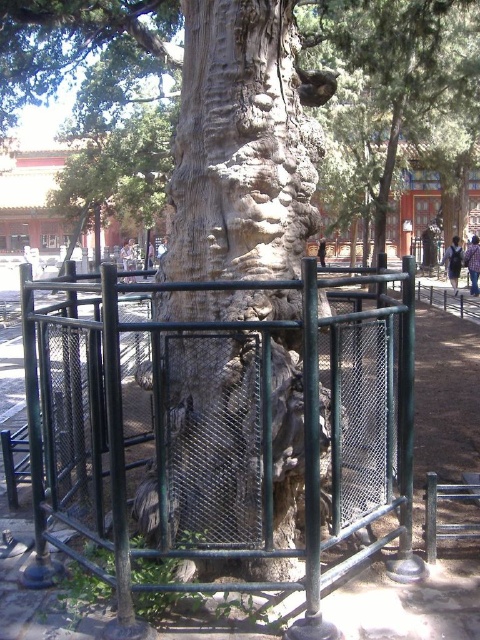
From the picture: Who is more distant from viewer, [176,337] or [20,8]?

Positioned behind is point [20,8].

Between green metal fence at center and rough bark tree at center, which one appears on the right side from the viewer's perspective?

Positioned to the right is green metal fence at center.

The image size is (480, 640). Identify the location of green metal fence at center. (222, 428).

This screenshot has width=480, height=640. Find the location of `rough bark tree at center`. rough bark tree at center is located at coordinates (78, 40).

Who is lower down, rough bark tree at center or smooth bark tree at upper center?

rough bark tree at center

This screenshot has width=480, height=640. What do you see at coordinates (78, 40) in the screenshot?
I see `rough bark tree at center` at bounding box center [78, 40].

Image resolution: width=480 pixels, height=640 pixels. I want to click on rough bark tree at center, so click(78, 40).

Does green metal fence at center lie behind smooth bark tree at upper center?

No.

Is point (384, 435) in front of point (396, 58)?

Yes.

Measure the distance between point (52, 508) and camera.

3.55 meters

The image size is (480, 640). Identify the location of green metal fence at center. (222, 428).